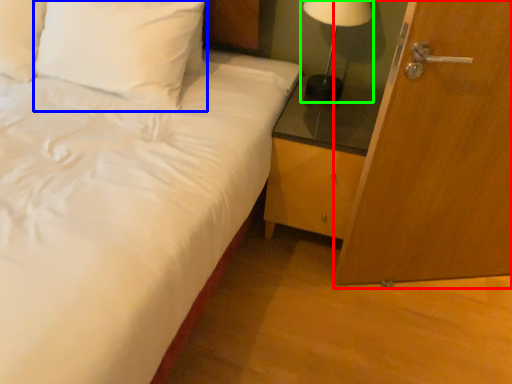
Question: Which is farther away from door (highlighted by a red box)? pillow (highlighted by a blue box) or table lamp (highlighted by a green box)?

Choices:
 (A) pillow
 (B) table lamp

Answer: (A)